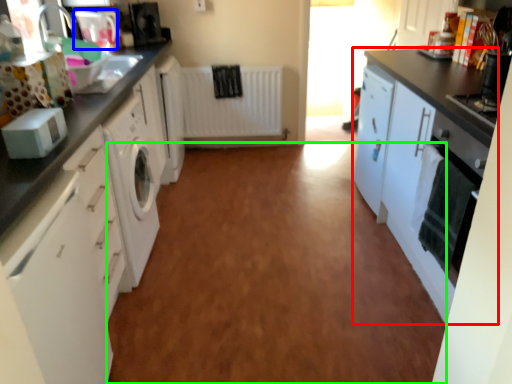
Question: Which is farther away from cabinetry (highlighted by a red box)? appliance (highlighted by a blue box) or plain (highlighted by a green box)?

Choices:
 (A) appliance
 (B) plain

Answer: (A)